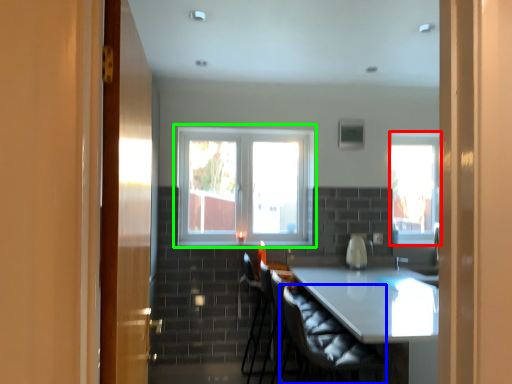
Question: Based on their relative distances, which object is farther from window (highlighted by a red box)? Choose from swivel chair (highlighted by a blue box) and window (highlighted by a green box).

Choices:
 (A) swivel chair
 (B) window

Answer: (A)